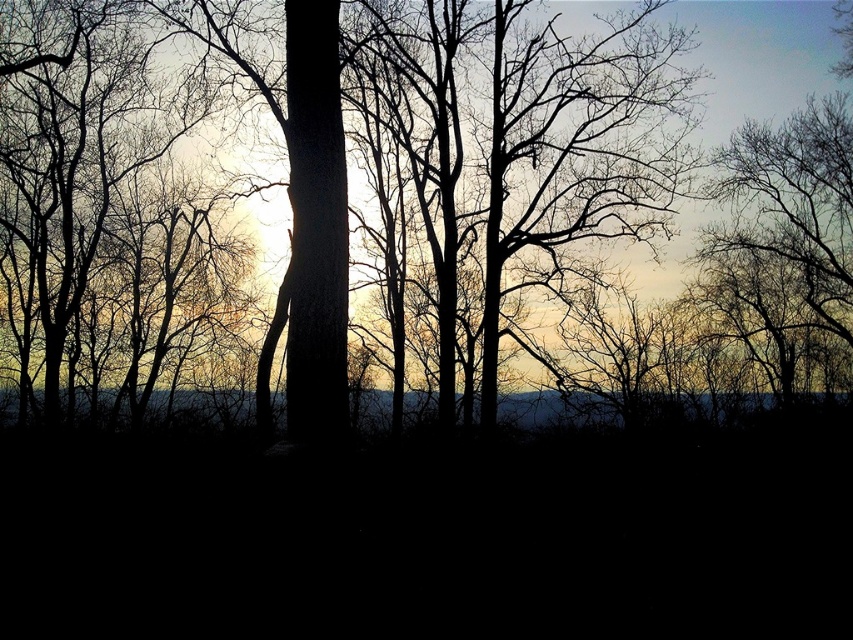
Question: Can you confirm if smooth bark tree at center is thinner than silhouette bark tree at center?

Choices:
 (A) no
 (B) yes

Answer: (A)

Question: Considering the relative positions of smooth bark tree at center and silhouette bark tree at center in the image provided, where is smooth bark tree at center located with respect to silhouette bark tree at center?

Choices:
 (A) below
 (B) above

Answer: (A)

Question: Which point is closer to the camera taking this photo?

Choices:
 (A) (616, 189)
 (B) (4, 100)

Answer: (A)

Question: Can you confirm if smooth bark tree at center is smaller than silhouette bark tree at center?

Choices:
 (A) no
 (B) yes

Answer: (A)